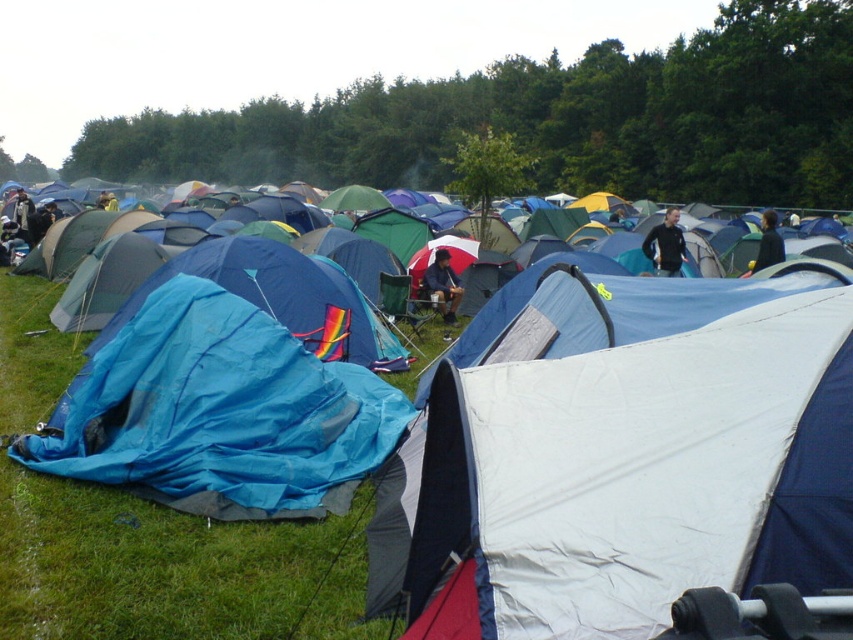
You are a camper trying to find shelter from the rain. You see the blue tarp at center and the blue fabric tent at lower left. Which one is higher up and could potentially provide better rain protection?

The blue tarp at center is above the blue fabric tent at lower left, so it is higher up and could provide better rain protection.

You are a photographer trying to capture the matte blue tent at center and the dark blue fabric jacket at upper right in a single frame. Given their sizes, which object would you need to position closer to the camera to ensure both fit well in the photo?

The matte blue tent at center is smaller than the dark blue fabric jacket at upper right. To ensure both fit well in the photo, you should position the matte blue tent at center closer to the camera since it is smaller and needs to be enlarged in the frame to balance with the larger jacket.